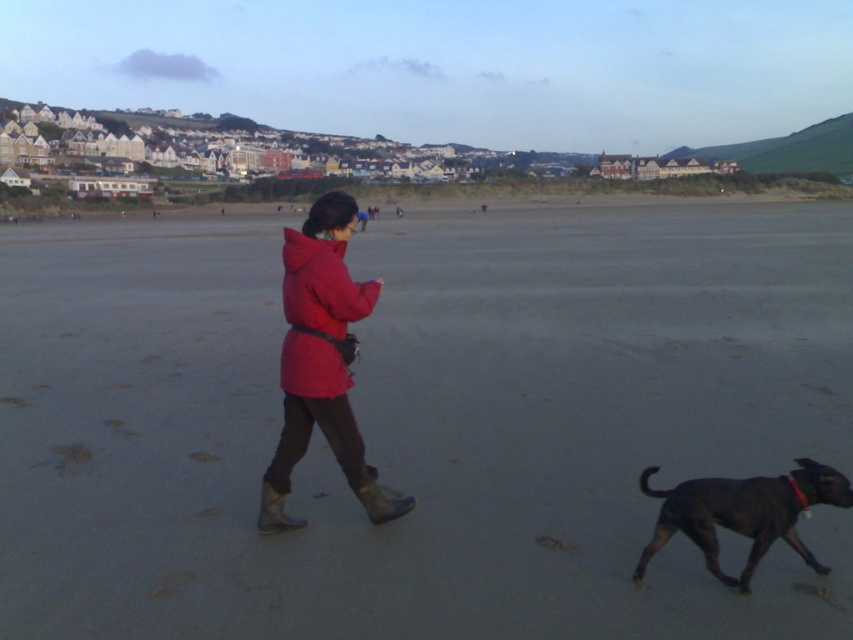
Question: Based on their relative distances, which object is farther from the matte red coat at center?

Choices:
 (A) matte red jacket at center
 (B) gray sand at center

Answer: (B)

Question: Does gray sand at center have a greater width compared to matte red coat at center?

Choices:
 (A) no
 (B) yes

Answer: (B)

Question: Which is farther from the matte red coat at center?

Choices:
 (A) shiny black dog at lower right
 (B) gray sand at center

Answer: (B)

Question: Which object is closer to the camera taking this photo?

Choices:
 (A) shiny black dog at lower right
 (B) matte red coat at center
 (C) gray sand at center
 (D) matte red jacket at center

Answer: (C)

Question: Does matte red coat at center lie behind shiny black dog at lower right?

Choices:
 (A) no
 (B) yes

Answer: (B)

Question: Is matte red coat at center thinner than matte red jacket at center?

Choices:
 (A) yes
 (B) no

Answer: (A)